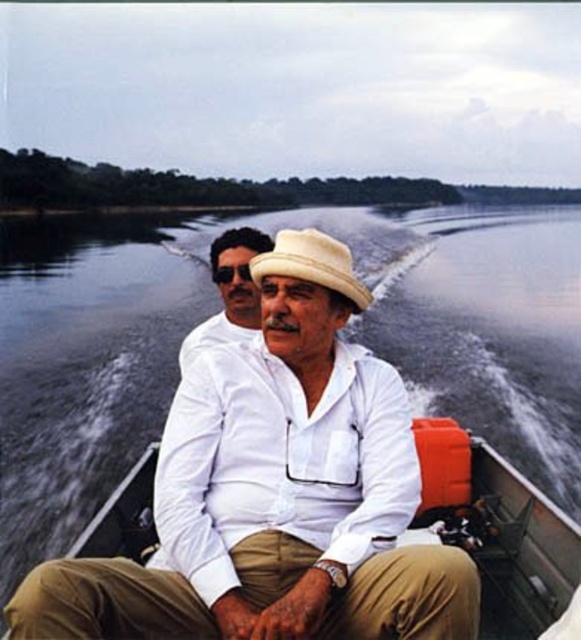
Which of these two, white cotton shirt at center or white fabric boat at center, stands taller?

With more height is white cotton shirt at center.

Which is behind, point (185, 624) or point (514, 632)?

Positioned behind is point (514, 632).

Locate an element on the screen. white cotton shirt at center is located at coordinates (274, 492).

Which of these two, khaki cotton pants at center or white straw hat at center, stands taller?

With more height is white straw hat at center.

From the picture: Does khaki cotton pants at center have a lesser width compared to white straw hat at center?

Incorrect, khaki cotton pants at center's width is not less than white straw hat at center's.

Does point (69, 620) come in front of point (315, 280)?

That is True.

The width and height of the screenshot is (581, 640). Identify the location of khaki cotton pants at center. (107, 602).

Based on the photo, is khaki cotton pants at center to the left of white fabric boat at center from the viewer's perspective?

Correct, you'll find khaki cotton pants at center to the left of white fabric boat at center.

Who is more forward, (382, 580) or (498, 529)?

Point (382, 580) is more forward.

This screenshot has width=581, height=640. What do you see at coordinates (107, 602) in the screenshot?
I see `khaki cotton pants at center` at bounding box center [107, 602].

Where is `khaki cotton pants at center`? Image resolution: width=581 pixels, height=640 pixels. khaki cotton pants at center is located at coordinates (107, 602).